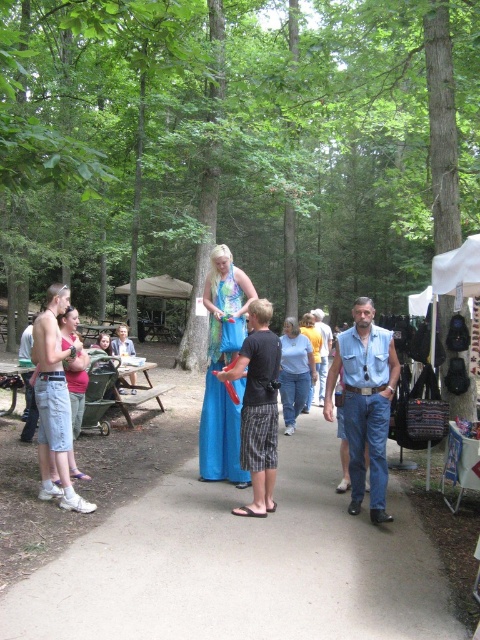
You are a person standing on the smooth concrete path at center. You want to place a small potted plant on the denim vest at center. Is the potted plant likely to stay in place?

The smooth concrete path at center is below denim vest at center, so the potted plant placed on the denim vest at center will stay in place since it is elevated.

You are standing on the smooth concrete path at center and want to reach the denim vest at center. Which direction should you move to get there?

You should move to the right because the denim vest at center is to the right of the smooth concrete path at center.